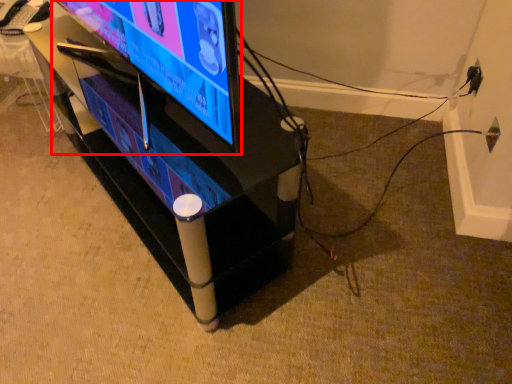
Question: Observing the image, what is the correct spatial positioning of television (annotated by the red box) in reference to furniture?

Choices:
 (A) left
 (B) right

Answer: (A)